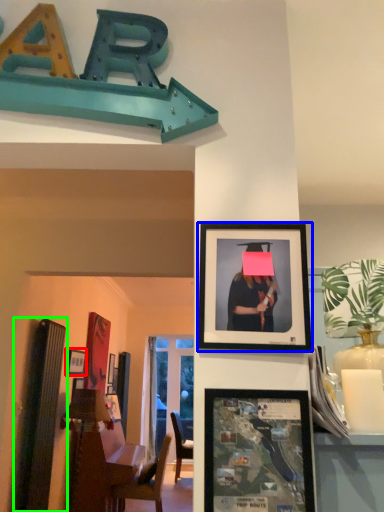
Question: Estimate the real-world distances between objects in this image. Which object is closer to picture frame (highlighted by a red box), picture frame (highlighted by a blue box) or bulletin board (highlighted by a green box)?

Choices:
 (A) picture frame
 (B) bulletin board

Answer: (B)